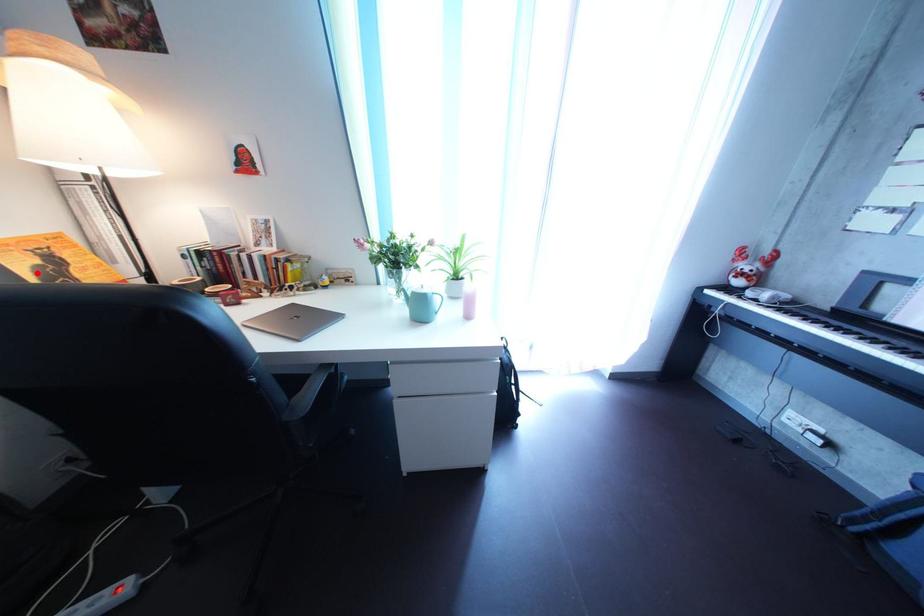
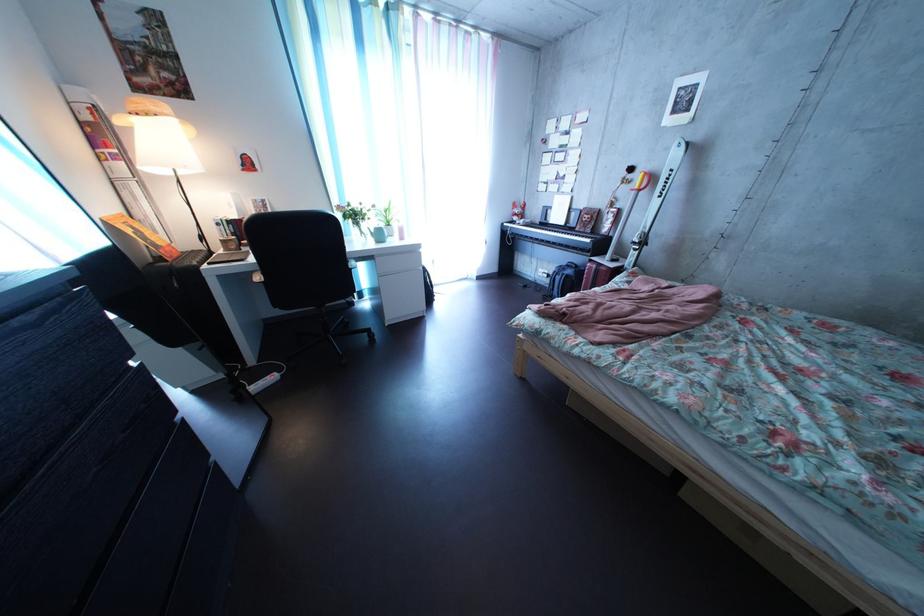
Question: I am providing you with two images of the same scene from different viewpoints. Given a red point in image1, look at the same physical point in image2. Is it:

Choices:
 (A) Closer to the viewpoint
 (B) Farther from the viewpoint

Answer: (A)